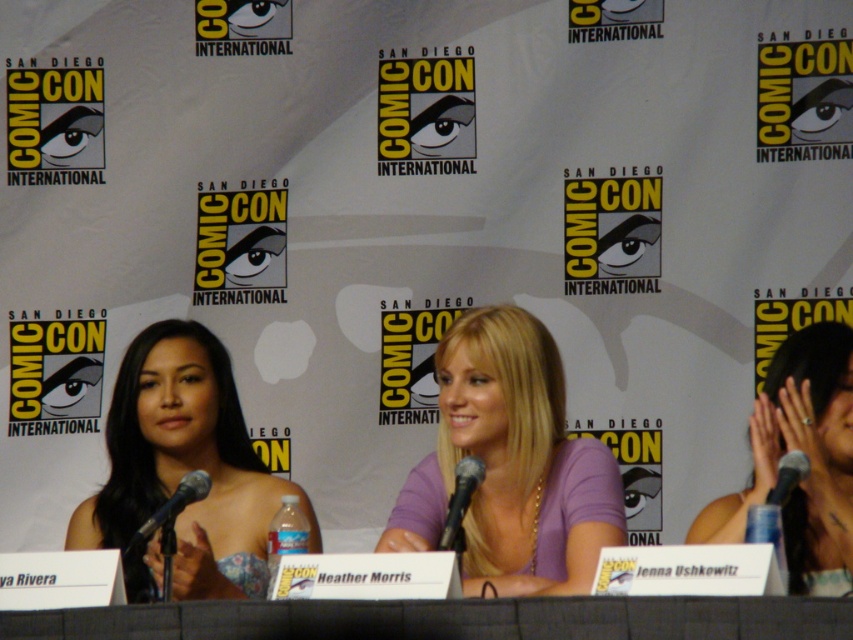
Question: Does matte black dress at left have a larger size compared to black metallic microphone at center?

Choices:
 (A) no
 (B) yes

Answer: (B)

Question: Which of these objects is positioned closest to the matte black dress at left?

Choices:
 (A) black matte microphone at center
 (B) purple matte shirt at center
 (C) black fabric table at center
 (D) black metallic microphone at left

Answer: (B)

Question: Is the position of black metallic microphone at center less distant than that of black matte microphone at center?

Choices:
 (A) no
 (B) yes

Answer: (B)

Question: Is black fabric table at center below black matte microphone at center?

Choices:
 (A) yes
 (B) no

Answer: (A)

Question: Which point is closer to the camera?

Choices:
 (A) (801, 470)
 (B) (457, 468)
 (C) (224, 627)
 (D) (134, 540)

Answer: (C)

Question: Which object appears farthest from the camera in this image?

Choices:
 (A) matte black dress at left
 (B) black metallic microphone at center
 (C) black metallic microphone at left
 (D) blonde hair at center

Answer: (D)